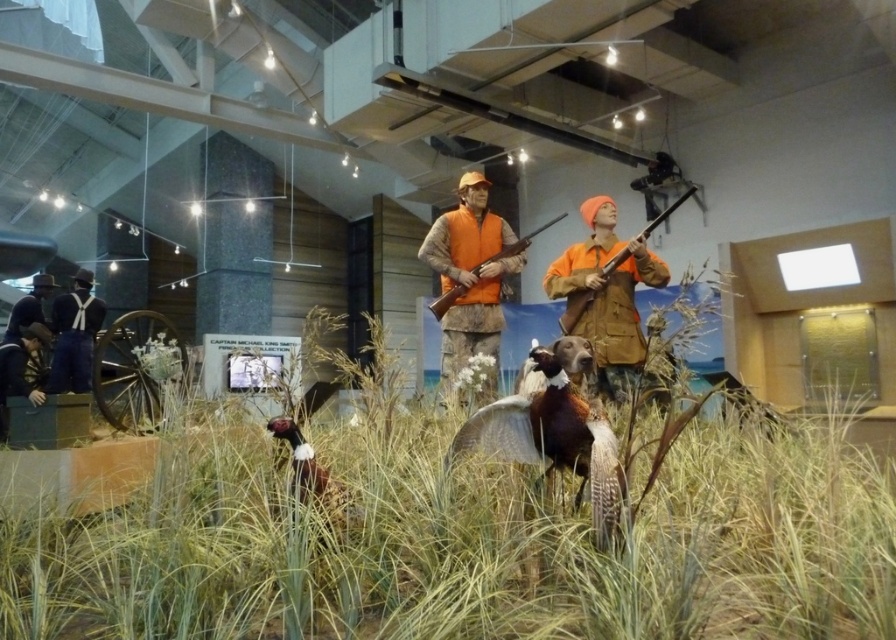
You are a visitor at the museum exhibit and want to describe the positions of the orange fabric jacket at center and the leather jacket at lower left to a friend. Based on the scene, which jacket is positioned higher?

The orange fabric jacket at center is located above the leather jacket at lower left, so it is positioned higher.

You are a visitor at the museum and want to take a photo of the brown feathered bird at center and the leather jacket at lower left. Which object should you focus on first if you want to capture both in the same frame without moving the camera?

The brown feathered bird at center is to the right of the leather jacket at lower left, so you should focus on the leather jacket at lower left first to ensure both are in the frame.